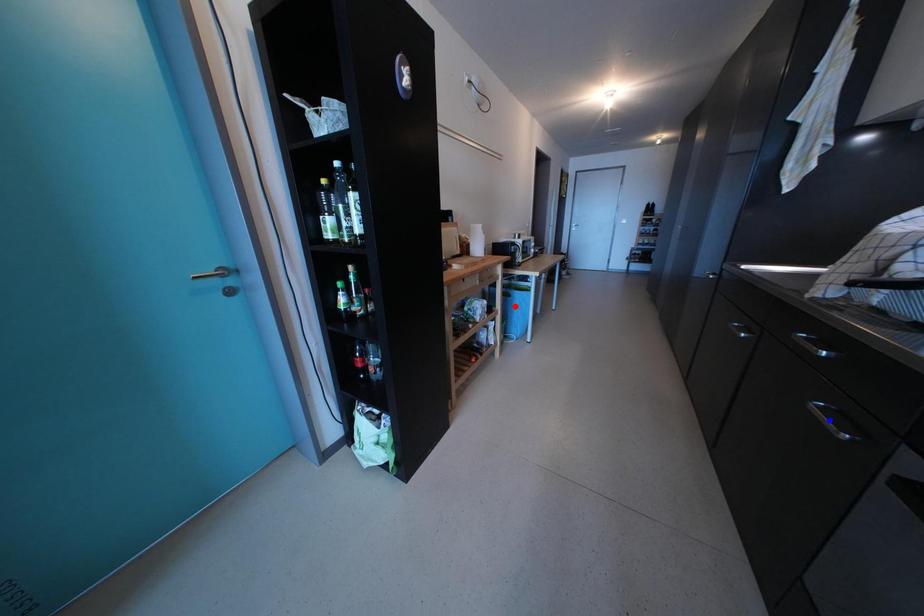
Question: In the image, two points are highlighted. Which point is nearer to the camera? Reply with the corresponding letter.

Choices:
 (A) blue point
 (B) red point

Answer: (A)